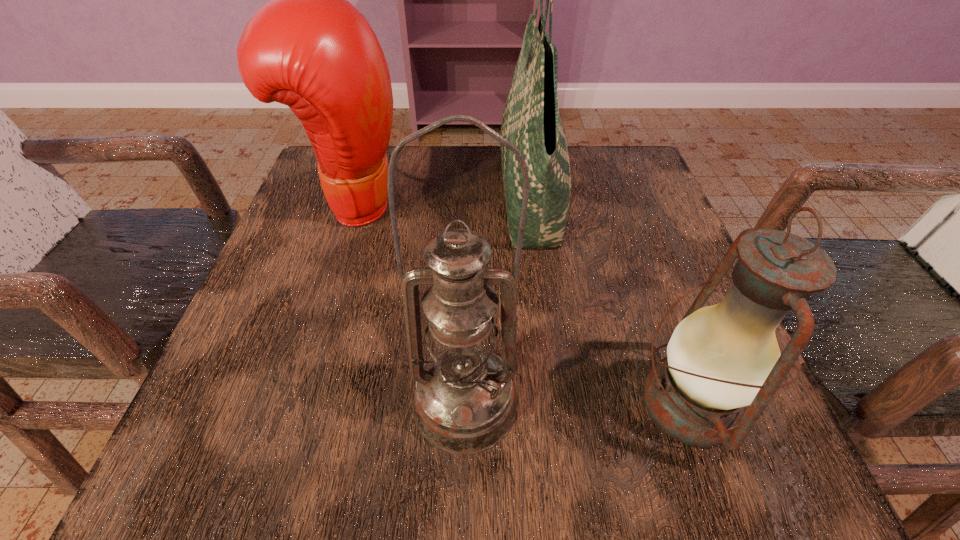
The width and height of the screenshot is (960, 540). I want to click on tote bag, so click(x=531, y=121).

Locate an element on the screen. the taller oil lamp is located at coordinates (465, 402).

You are a GUI agent. You are given a task and a screenshot of the screen. Output one action in this format:
    pyautogui.click(x=<x>, y=<y>)
    Task: Click on the boxing glove
    
    Given the screenshot: What is the action you would take?
    pyautogui.click(x=309, y=48)

Locate an element on the screen. This screenshot has height=540, width=960. the shorter oil lamp is located at coordinates (721, 358).

Locate an element on the screen. This screenshot has width=960, height=540. the right oil lamp is located at coordinates (721, 358).

Where is `vacant region located on the front of the tote bag`? The height and width of the screenshot is (540, 960). vacant region located on the front of the tote bag is located at coordinates (564, 462).

This screenshot has width=960, height=540. Find the location of `vacant space located on the back of the left oil lamp`. vacant space located on the back of the left oil lamp is located at coordinates (469, 225).

Locate an element on the screen. vacant space located on the striking surface of the boxing glove is located at coordinates (519, 205).

Where is `free location located 0.070m on the back of the shortest object`? free location located 0.070m on the back of the shortest object is located at coordinates (656, 312).

Locate an element on the screen. This screenshot has height=540, width=960. tote bag that is at the far edge is located at coordinates (531, 121).